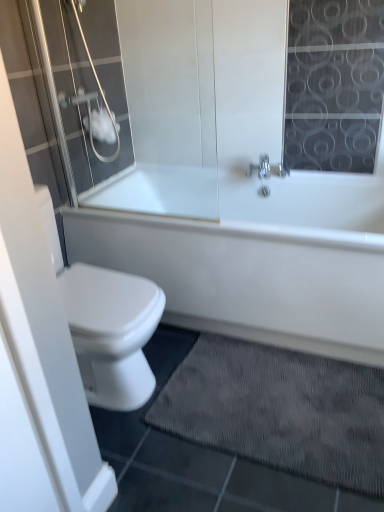
Question: Is white glossy bathtub at center oriented towards transparent glass shower door at upper left?

Choices:
 (A) yes
 (B) no

Answer: (B)

Question: Is white glossy bathtub at center smaller than transparent glass shower door at upper left?

Choices:
 (A) no
 (B) yes

Answer: (A)

Question: Is white glossy bathtub at center at the left side of transparent glass shower door at upper left?

Choices:
 (A) yes
 (B) no

Answer: (B)

Question: From a real-world perspective, is white glossy bathtub at center located higher than transparent glass shower door at upper left?

Choices:
 (A) yes
 (B) no

Answer: (B)

Question: From a real-world perspective, does white glossy bathtub at center sit lower than transparent glass shower door at upper left?

Choices:
 (A) no
 (B) yes

Answer: (B)

Question: Would you say white glossy bathtub at center is inside or outside transparent glass shower door at upper left?

Choices:
 (A) inside
 (B) outside

Answer: (B)

Question: Is white glossy bathtub at center bigger or smaller than transparent glass shower door at upper left?

Choices:
 (A) big
 (B) small

Answer: (A)

Question: From the image's perspective, is white glossy bathtub at center above or below transparent glass shower door at upper left?

Choices:
 (A) below
 (B) above

Answer: (A)

Question: Is white glossy bathtub at center taller or shorter than transparent glass shower door at upper left?

Choices:
 (A) tall
 (B) short

Answer: (B)

Question: Is dark gray textured bath mat at lower center in front of or behind transparent glass shower door at upper left in the image?

Choices:
 (A) front
 (B) behind

Answer: (A)

Question: Does point (301, 432) appear closer or farther from the camera than point (44, 25)?

Choices:
 (A) closer
 (B) farther

Answer: (A)

Question: Would you say dark gray textured bath mat at lower center is to the left or to the right of transparent glass shower door at upper left in the picture?

Choices:
 (A) right
 (B) left

Answer: (A)

Question: From a real-world perspective, is dark gray textured bath mat at lower center positioned above or below transparent glass shower door at upper left?

Choices:
 (A) below
 (B) above

Answer: (A)

Question: Is point (92, 117) positioned closer to the camera than point (269, 218)?

Choices:
 (A) farther
 (B) closer

Answer: (B)

Question: From a real-world perspective, is white matte toilet paper at upper left above or below white glossy bathtub at center?

Choices:
 (A) above
 (B) below

Answer: (A)